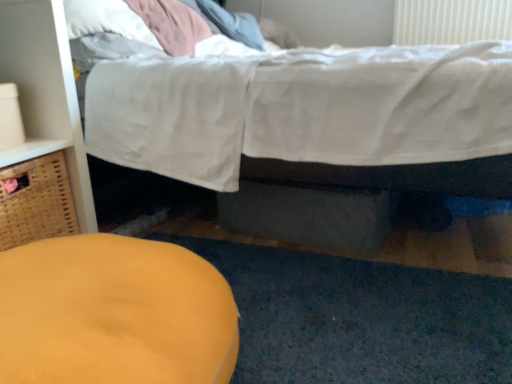
Question: In terms of size, does woven brown basket at left appear bigger or smaller than matte yellow ottoman at lower left?

Choices:
 (A) small
 (B) big

Answer: (A)

Question: Is point (61, 213) closer or farther from the camera than point (187, 276)?

Choices:
 (A) closer
 (B) farther

Answer: (B)

Question: Which object is positioned closest to the woven brown basket at left?

Choices:
 (A) white cotton bed at upper center
 (B) matte wood dresser at left
 (C) white plastic radiator at upper right
 (D) matte yellow ottoman at lower left

Answer: (B)

Question: Which object is the farthest from the white plastic radiator at upper right?

Choices:
 (A) white cotton bed at upper center
 (B) matte wood dresser at left
 (C) matte yellow ottoman at lower left
 (D) woven brown basket at left

Answer: (C)